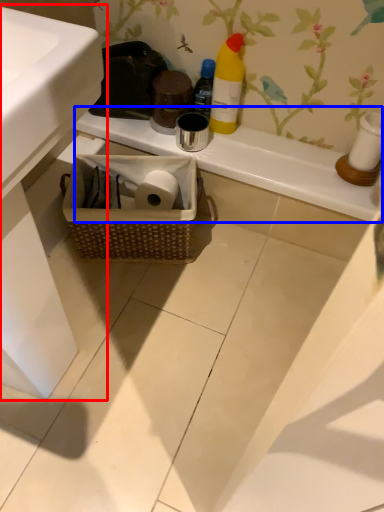
Question: Which object is closer to the camera taking this photo, sink (highlighted by a red box) or counter top (highlighted by a blue box)?

Choices:
 (A) sink
 (B) counter top

Answer: (A)